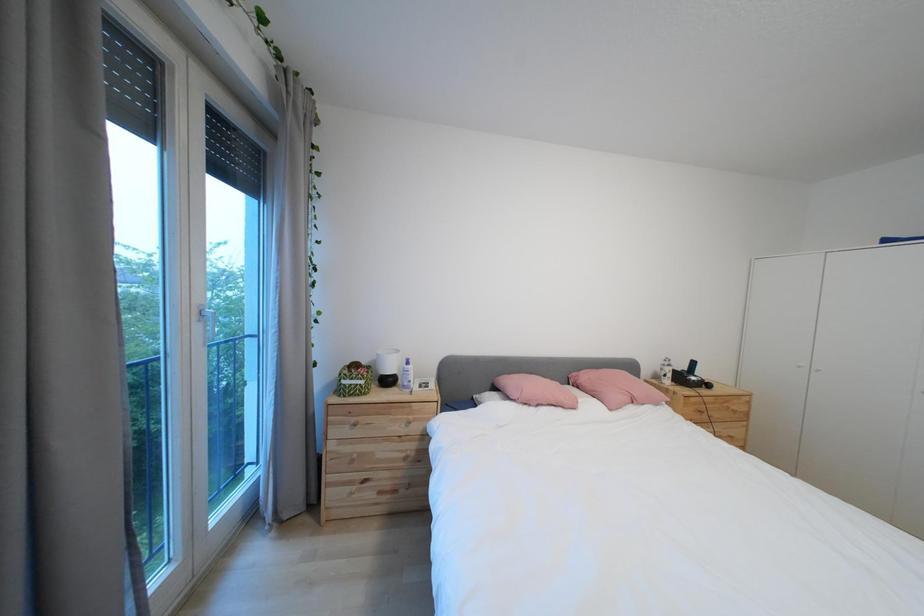
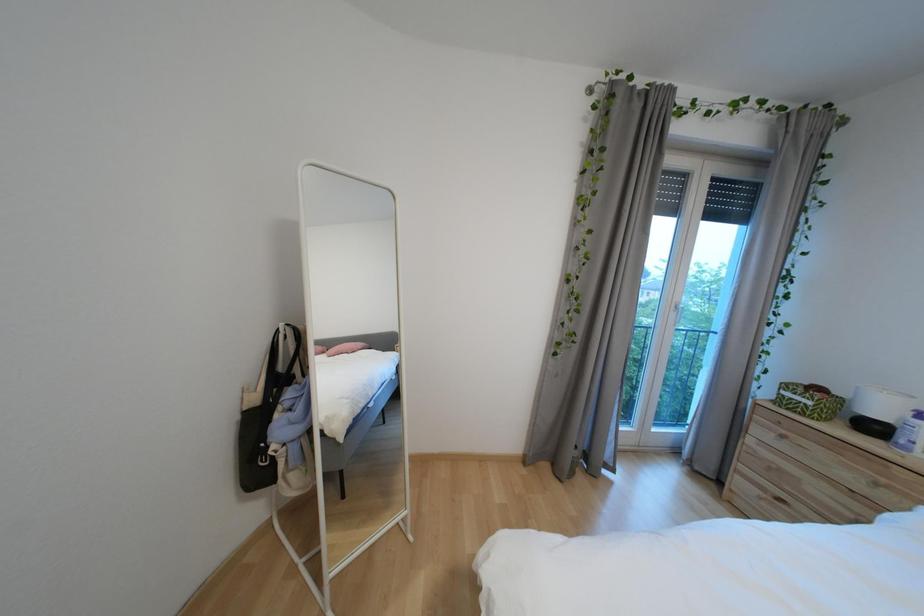
Question: The camera is either moving clockwise (left) or counter-clockwise (right) around the object. The first image is from the beginning of the video and the second image is from the end. Is the camera moving left or right when shooting the video?

Choices:
 (A) Left
 (B) Right

Answer: (B)